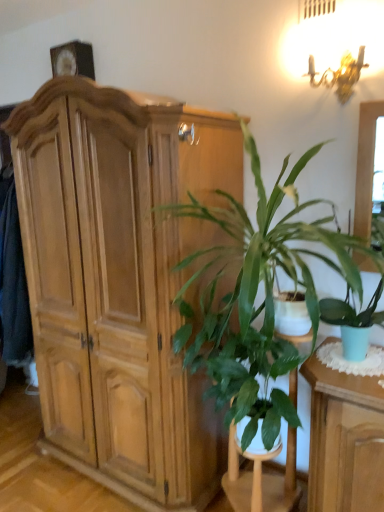
Where is `light brown wood cabinet at left`? light brown wood cabinet at left is located at coordinates (119, 282).

Find the location of a particular element. This screenshot has height=512, width=384. green leafy plant at center is located at coordinates (261, 479).

Identify the location of light brown wood cabinet at left. (119, 282).

Could you tell me if green leafy plant at center is turned towards light brown wood cabinet at left?

No, green leafy plant at center does not turn towards light brown wood cabinet at left.

Looking at this image, is green leafy plant at center not within light brown wood cabinet at left?

Yes, green leafy plant at center is located beyond the bounds of light brown wood cabinet at left.

Considering the relative positions of green leafy plant at center and light brown wood cabinet at left in the image provided, is green leafy plant at center to the left or to the right of light brown wood cabinet at left?

Based on their positions, green leafy plant at center is located to the right of light brown wood cabinet at left.

The height and width of the screenshot is (512, 384). In order to click on cabinetry on the left of green leafy plant at center in this screenshot , I will do `click(119, 282)`.

From the image's perspective, is light brown wood cabinet at left over green glossy plant at center?

No, from the image's perspective, light brown wood cabinet at left is not above green glossy plant at center.

Considering the sizes of light brown wood cabinet at left and green glossy plant at center in the image, is light brown wood cabinet at left wider or thinner than green glossy plant at center?

Considering their sizes, light brown wood cabinet at left looks slimmer than green glossy plant at center.

Measure the distance from light brown wood cabinet at left to green glossy plant at center.

light brown wood cabinet at left and green glossy plant at center are 15.25 inches apart from each other.

Which object is further away from the camera, light brown wood cabinet at left or green glossy plant at center?

light brown wood cabinet at left.

Which object is closer to the camera taking this photo, green glossy plant at center or green leafy plant at center?

green glossy plant at center is closer to the camera.

Considering the sizes of objects green glossy plant at center and green leafy plant at center in the image provided, who is taller, green glossy plant at center or green leafy plant at center?

green glossy plant at center is taller.

Is green glossy plant at center far away from green leafy plant at center?

No, green glossy plant at center is in close proximity to green leafy plant at center.

Is green glossy plant at center positioned with its back to green leafy plant at center?

green glossy plant at center is not turned away from green leafy plant at center.

Could you tell me if light brown wood cabinet at left is facing green leafy plant at center?

No, light brown wood cabinet at left is not turned towards green leafy plant at center.

Does light brown wood cabinet at left have a larger size compared to green leafy plant at center?

Yes, light brown wood cabinet at left is bigger than green leafy plant at center.

What's the angular difference between light brown wood cabinet at left and green leafy plant at center's facing directions?

The angle between the facing direction of light brown wood cabinet at left and the facing direction of green leafy plant at center is 4.05 degrees.

Is light brown wood cabinet at left with green leafy plant at center?

No, light brown wood cabinet at left is not in contact with green leafy plant at center.

Is green glossy plant at center looking in the opposite direction of light brown wood cabinet at left?

No, green glossy plant at center is not facing the opposite direction of light brown wood cabinet at left.

From the picture: From a real-world perspective, is green glossy plant at center over light brown wood cabinet at left?

Yes.

Can you confirm if green glossy plant at center is smaller than light brown wood cabinet at left?

Yes.

From the image's perspective, is green glossy plant at center over light brown wood cabinet at left?

Yes, from the image's perspective, green glossy plant at center is above light brown wood cabinet at left.

From a real-world perspective, is green leafy plant at center over green glossy plant at center?

No, from a real-world perspective, green leafy plant at center is not on top of green glossy plant at center.

Are green leafy plant at center and green glossy plant at center making contact?

No, green leafy plant at center is not next to green glossy plant at center.

Which object is thinner, green leafy plant at center or green glossy plant at center?

Thinner between the two is green leafy plant at center.

What's the angular difference between green leafy plant at center and green glossy plant at center's facing directions?

1.24 degrees.

What are the coordinates of `armchair in front of the light brown wood cabinet at left` in the screenshot? It's located at (261, 479).

Where is `cabinetry to the left of green glossy plant at center`? The image size is (384, 512). cabinetry to the left of green glossy plant at center is located at coordinates tap(119, 282).

Looking at the image, which one is located further to green leafy plant at center, light brown wood cabinet at left or green glossy plant at center?

light brown wood cabinet at left lies further to green leafy plant at center than the other object.

From the image, which object appears to be farther from green glossy plant at center, light brown wood cabinet at left or green leafy plant at center?

light brown wood cabinet at left.

From the image, which object appears to be farther from green leafy plant at center, green glossy plant at center or light brown wood cabinet at left?

light brown wood cabinet at left is further to green leafy plant at center.

Estimate the real-world distances between objects in this image. Which object is closer to light brown wood cabinet at left, green leafy plant at center or green glossy plant at center?

The object closer to light brown wood cabinet at left is green glossy plant at center.

Estimate the real-world distances between objects in this image. Which object is closer to light brown wood cabinet at left, green glossy plant at center or green leafy plant at center?

green glossy plant at center.

Considering their positions, is green leafy plant at center positioned further to green glossy plant at center than light brown wood cabinet at left?

light brown wood cabinet at left is positioned further to the anchor green glossy plant at center.

Where is `armchair between light brown wood cabinet at left and green glossy plant at center from left to right`? This screenshot has width=384, height=512. armchair between light brown wood cabinet at left and green glossy plant at center from left to right is located at coordinates (261, 479).